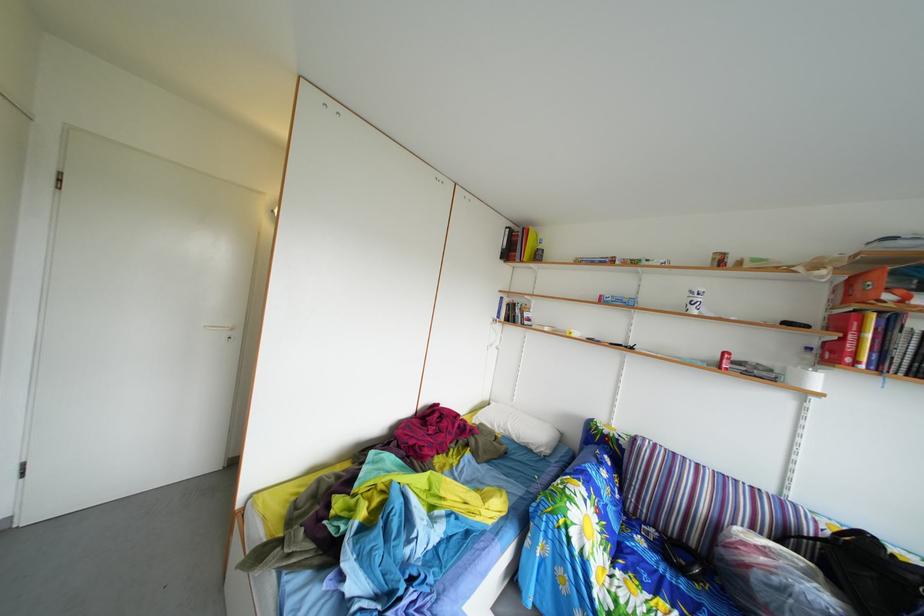
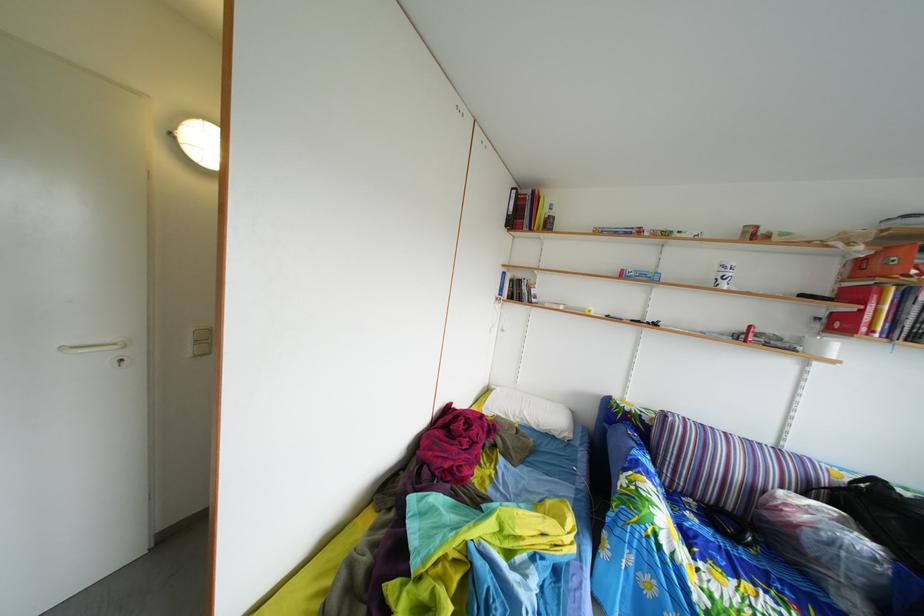
The point at [703,552] is marked in the first image. Where is the corresponding point in the second image?

(739, 516)